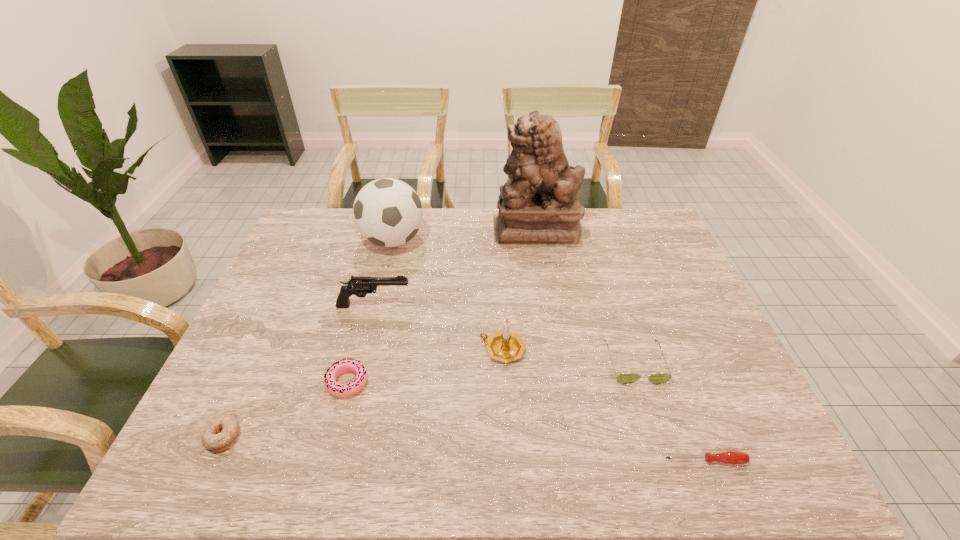
This screenshot has height=540, width=960. What are the coordinates of `free space between the nearest object and the sculpture` in the screenshot? It's located at (620, 346).

You are a GUI agent. You are given a task and a screenshot of the screen. Output one action in this format:
    pyautogui.click(x=<x>, y=<y>)
    Task: Click on the free space between the left doughnut and the candle holder
    This screenshot has height=540, width=960.
    Given the screenshot: What is the action you would take?
    pyautogui.click(x=363, y=393)

You are a GUI agent. You are given a task and a screenshot of the screen. Output one action in this format:
    pyautogui.click(x=<x>, y=<y>)
    Task: Click on the vacant region between the right doughnut and the leftmost object
    This screenshot has height=540, width=960.
    Given the screenshot: What is the action you would take?
    pyautogui.click(x=285, y=409)

Identify which object is located as the third nearest to the screwdriver. Please provide its 2D coordinates. Your answer should be formatted as a tuple, i.e. [(x, y)], where the tuple contains the x and y coordinates of a point satisfying the conditions above.

[(338, 390)]

This screenshot has width=960, height=540. I want to click on the seventh closest object to the nearest object, so click(x=221, y=433).

Find the location of a particular element. The image size is (960, 540). free spot that satisfies the following two spatial constraints: 1. on the front-facing side of the sculpture; 2. on the front side of the candle holder is located at coordinates (555, 350).